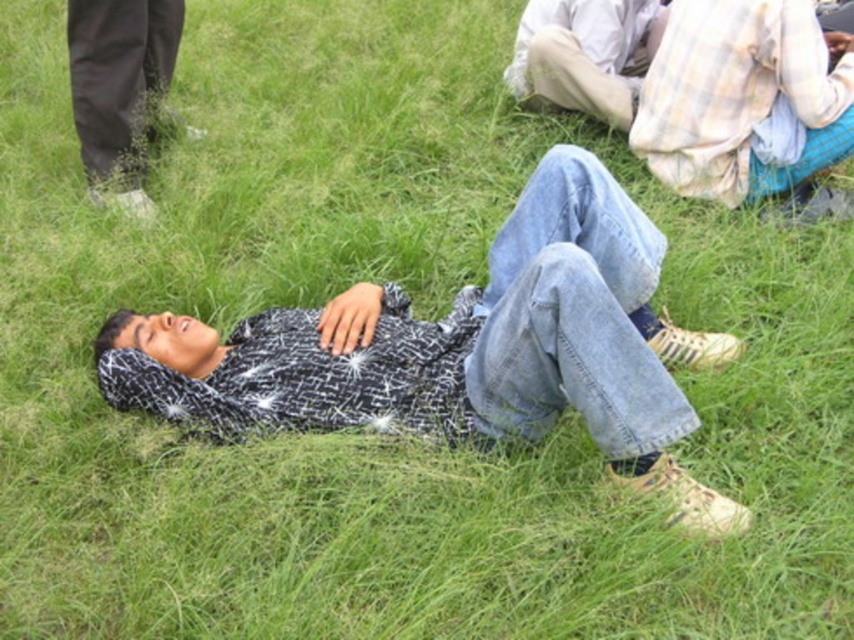
In the scene shown: You are a photographer standing at the camera position. You want to take a closeup photo of the plaid fabric shirt at upper right. What should you do to ensure the subject is in focus?

The plaid fabric shirt at upper right is 3.18 meters away from camera, so you should adjust the focus distance to 3.18 meters to ensure the subject is in focus.

You are a photographer trying to capture a closeup shot of the patterned shirt at center and the black matte pants at upper left. Since you want both objects to appear the same size in your photo, which object should you move closer to the camera?

The patterned shirt at center is bigger than the black matte pants at upper left, so you should move the black matte pants at upper left closer to the camera to make them appear the same size as the patterned shirt at center in the photo.

You are a photographer trying to capture a closeup of the plaid fabric shirt at upper right and the black matte pants at upper left in the image. Given that your camera can only focus on objects within a 3 meter range, can you determine which object is closer to the camera based on their sizes?

The plaid fabric shirt at upper right is larger in size compared to the black matte pants at upper left, which indicates it is closer to the camera. Since the camera can focus within 3 meters, both objects are likely within range, but the plaid fabric shirt at upper right is closer.